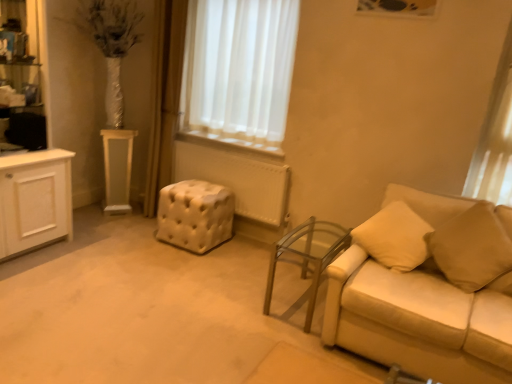
Question: Would you say beige fabric pillow at right is inside or outside white tufted ottoman at center?

Choices:
 (A) inside
 (B) outside

Answer: (B)

Question: From the image's perspective, is beige fabric pillow at right located above or below white tufted ottoman at center?

Choices:
 (A) below
 (B) above

Answer: (A)

Question: Based on their relative distances, which object is farther from the transparent glass table at lower right, the 1th table from the right?

Choices:
 (A) white tufted ottoman at center
 (B) beige leather couch at right
 (C) beige fabric pillow at right
 (D) white glossy pedestal at left, the first table positioned from the back

Answer: (D)

Question: Estimate the real-world distances between objects in this image. Which object is farther from the white tufted ottoman at center?

Choices:
 (A) transparent glass table at lower right, which is counted as the second table, starting from the top
 (B) beige leather couch at right
 (C) white glossy pedestal at left, placed as the 2th table when sorted from bottom to top
 (D) beige fabric pillow at right

Answer: (D)